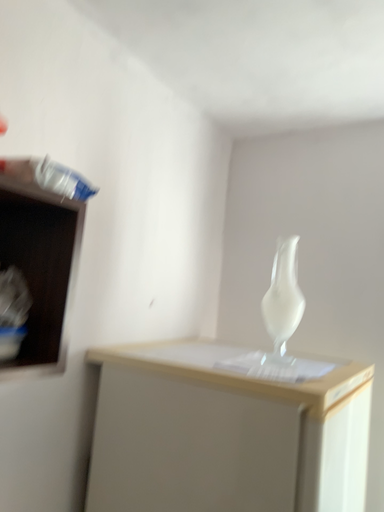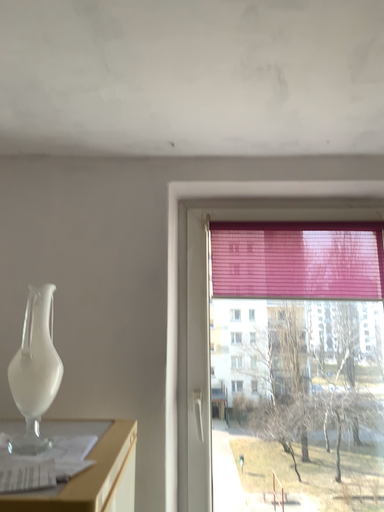
Question: How did the camera likely rotate when shooting the video?

Choices:
 (A) rotated left
 (B) rotated right

Answer: (B)